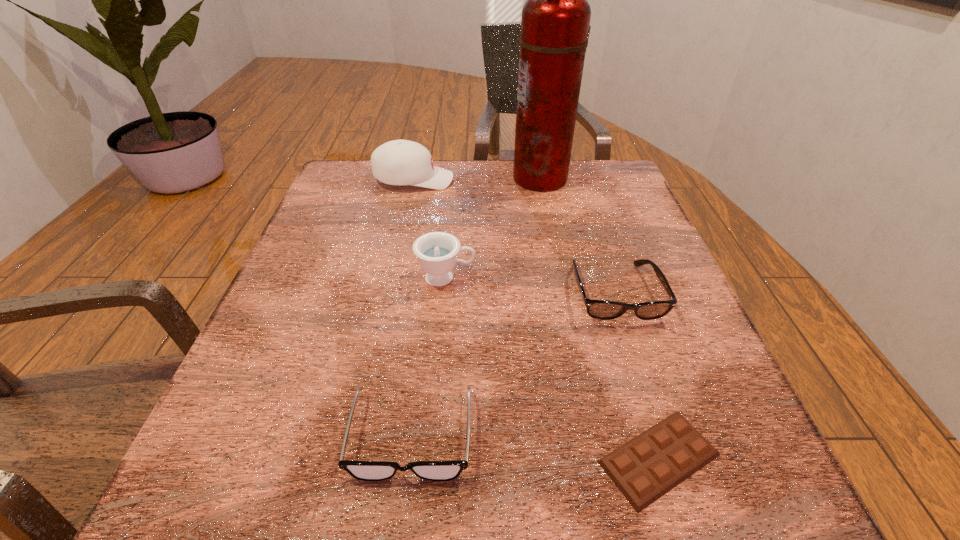
Identify the location of free spot that satisfies the following two spatial constraints: 1. on the front-facing side of the left spectacles; 2. on the left side of the shortest object. The width and height of the screenshot is (960, 540). (409, 458).